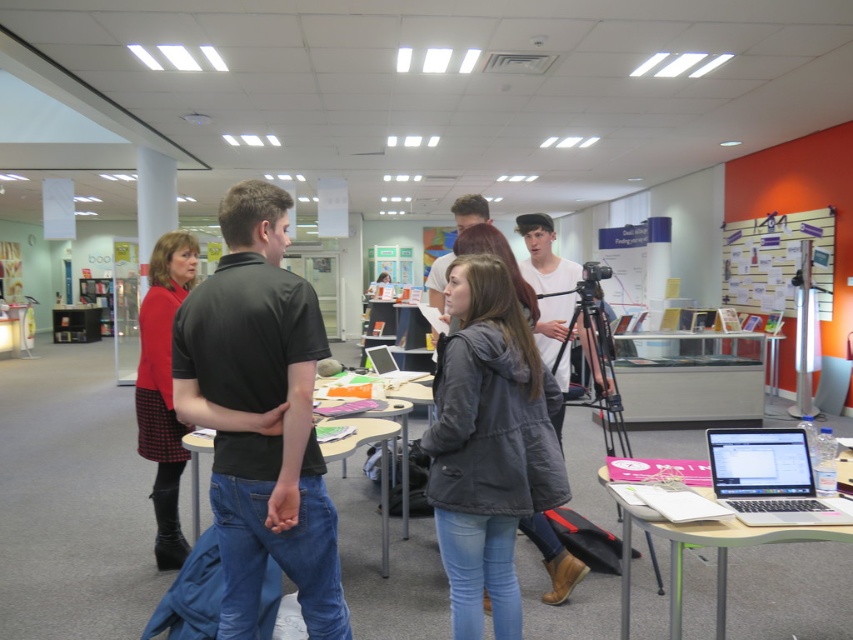
Question: Can you confirm if dark gray jacket at center is positioned to the left of silver metallic tablet at center?

Choices:
 (A) no
 (B) yes

Answer: (A)

Question: Which object is the farthest from the silver metallic laptop at lower right?

Choices:
 (A) light wood table at lower right
 (B) black matte shirt at center
 (C) red knit sweater at left
 (D) metallic silver table at center

Answer: (D)

Question: Which point is farther from the camera taking this photo?

Choices:
 (A) (480, 372)
 (B) (193, 420)

Answer: (A)

Question: Estimate the real-world distances between objects in this image. Which object is closer to the black matte shirt at center?

Choices:
 (A) light wood table at lower right
 (B) metallic silver table at center
 (C) wooden table at center

Answer: (C)

Question: Considering the relative positions of wooden table at center and silver metallic tablet at center in the image provided, where is wooden table at center located with respect to silver metallic tablet at center?

Choices:
 (A) right
 (B) left

Answer: (B)

Question: Does silver metallic laptop at lower right lie in front of wooden table at center?

Choices:
 (A) yes
 (B) no

Answer: (A)